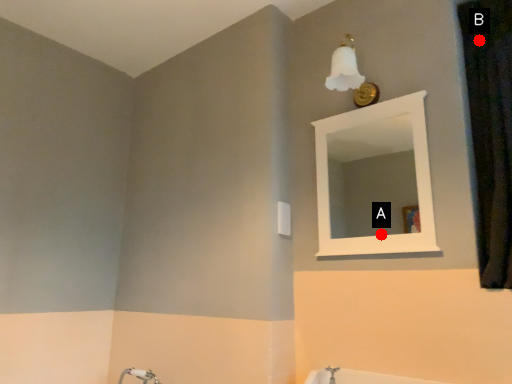
Question: Two points are circled on the image, labeled by A and B beside each circle. Which point is farther from the camera taking this photo?

Choices:
 (A) A is further
 (B) B is further

Answer: (A)